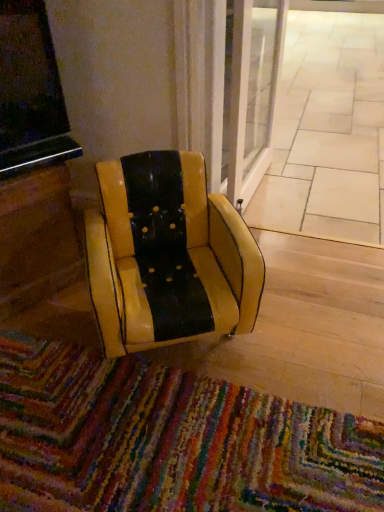
Question: In the image, is multicolored woven mat at lower center on the left side or the right side of yellow leather chair at center?

Choices:
 (A) right
 (B) left

Answer: (B)

Question: Is point click(x=321, y=467) closer or farther from the camera than point click(x=137, y=164)?

Choices:
 (A) farther
 (B) closer

Answer: (B)

Question: Which of these objects is positioned closest to the beige tile pavement at center?

Choices:
 (A) multicolored woven mat at lower center
 (B) yellow leather chair at center

Answer: (B)

Question: Based on their relative distances, which object is nearer to the beige tile pavement at center?

Choices:
 (A) yellow leather chair at center
 (B) multicolored woven mat at lower center

Answer: (A)